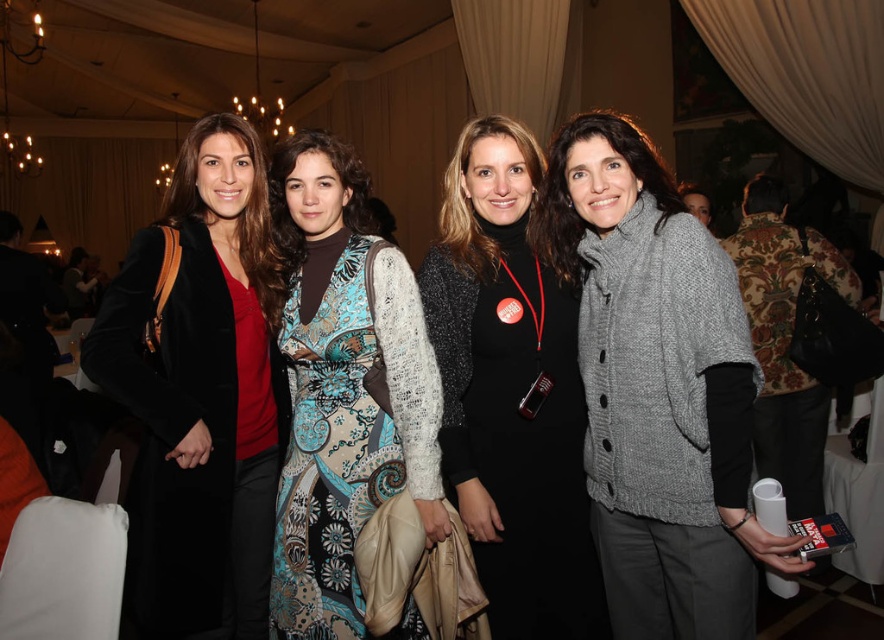
Between matte black coat at left and black glitter dress at center, which one has more height?

matte black coat at left

Is point (179, 458) positioned behind point (570, 333)?

That is False.

Image resolution: width=884 pixels, height=640 pixels. What are the coordinates of `matte black coat at left` in the screenshot? It's located at tap(200, 392).

In the scene shown: Who is lower down, black glitter dress at center or patterned fabric dress at center?

Positioned lower is black glitter dress at center.

Locate an element on the screen. black glitter dress at center is located at coordinates (509, 392).

Who is more forward, [547,588] or [313,458]?

Point [313,458] is more forward.

At what (x,y) coordinates should I click in order to perform the action: click on black glitter dress at center. Please return your answer as a coordinate pair (x, y). This screenshot has width=884, height=640. Looking at the image, I should click on (509, 392).

Does point (702, 312) lie behind point (271, 305)?

No, (702, 312) is in front of (271, 305).

Where is `knitted gray sweater at center`? knitted gray sweater at center is located at coordinates (658, 388).

Is point (705, 250) less distant than point (181, 480)?

Yes, point (705, 250) is in front of point (181, 480).

Identify the location of knitted gray sweater at center. (658, 388).